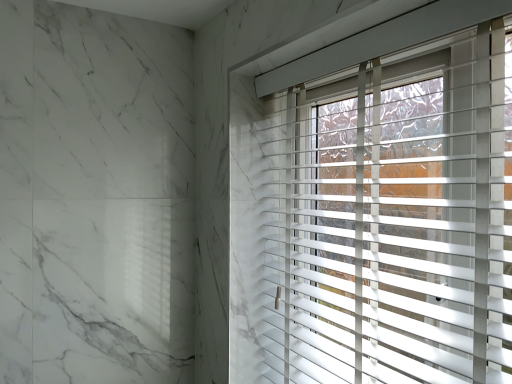
This screenshot has height=384, width=512. Find the location of `white plastic blinds at upper right`. white plastic blinds at upper right is located at coordinates (391, 219).

What do you see at coordinates (391, 219) in the screenshot?
I see `white plastic blinds at upper right` at bounding box center [391, 219].

Locate an element on the screen. white plastic blinds at upper right is located at coordinates (391, 219).